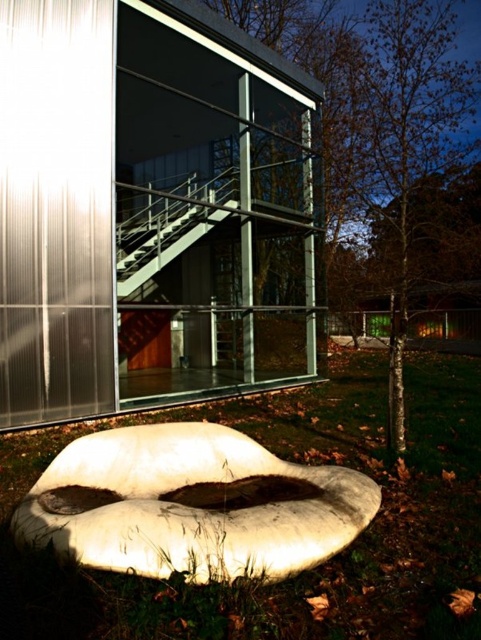
Based on the photo, which is above, green grass at lower center or metallic staircase at center?

metallic staircase at center is above.

Who is more distant from viewer, [295,444] or [178,220]?

The point [178,220] is more distant.

Between point (430, 458) and point (143, 275), which one is positioned in front?

Point (430, 458)

Locate an element on the screen. The height and width of the screenshot is (640, 481). green grass at lower center is located at coordinates (312, 570).